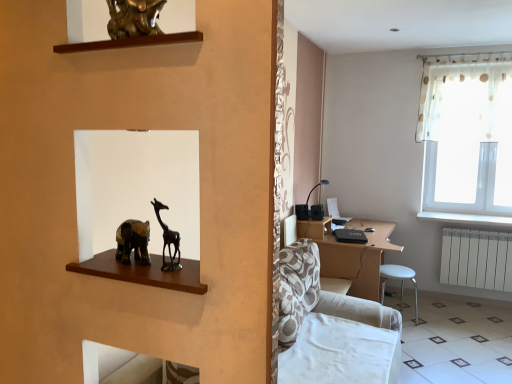
Where is `white painted wood at right`? white painted wood at right is located at coordinates pos(466,218).

Describe the element at coordinates (455, 342) in the screenshot. I see `white glossy tile at lower right` at that location.

You are a GUI agent. You are given a task and a screenshot of the screen. Output one action in this format:
    pyautogui.click(x=<x>, y=<y>)
    Task: Click on the white glossy tile at lower right
    This screenshot has width=512, height=384.
    Given the screenshot: What is the action you would take?
    pyautogui.click(x=455, y=342)

Describe the element at coordinates (315, 188) in the screenshot. Image resolution: width=512 pixels, height=384 pixels. I see `matte black table lamp at center-right` at that location.

Where is `white painted wood at right`? The width and height of the screenshot is (512, 384). white painted wood at right is located at coordinates (466, 218).

Considering the relative sizes of white painted wood at right and white plastic stool at lower right in the image provided, is white painted wood at right bigger than white plastic stool at lower right?

Actually, white painted wood at right might be smaller than white plastic stool at lower right.

Is white painted wood at right to the left of white plastic stool at lower right from the viewer's perspective?

In fact, white painted wood at right is to the right of white plastic stool at lower right.

Which point is more forward, (448, 221) or (407, 277)?

Point (407, 277)

Looking at their sizes, would you say white painted wood at right is wider or thinner than white plastic stool at lower right?

In the image, white painted wood at right appears to be wider than white plastic stool at lower right.

Locate an element on the screen. bar stool that appears in front of the white plastic radiator at lower right is located at coordinates (399, 279).

Is white plastic stool at lower right oriented towards white plastic radiator at lower right?

No, white plastic stool at lower right is not turned towards white plastic radiator at lower right.

Does point (386, 266) come closer to viewer compared to point (450, 283)?

Yes, point (386, 266) is in front of point (450, 283).

Is white plastic stool at lower right placed right next to white plastic radiator at lower right?

No, white plastic stool at lower right is not next to white plastic radiator at lower right.

Could white glossy tile at lower right be considered to be inside white painted wood at right?

Actually, white glossy tile at lower right is outside white painted wood at right.

Is white painted wood at right wider or thinner than white glossy tile at lower right?

white painted wood at right is thinner than white glossy tile at lower right.

Is white painted wood at right shorter than white glossy tile at lower right?

Correct, white painted wood at right is not as tall as white glossy tile at lower right.

From a real-world perspective, does white painted wood at right stand above white glossy tile at lower right?

Yes, from a real-world perspective, white painted wood at right is over white glossy tile at lower right

Considering the positions of objects white glossy tile at lower right and white plastic radiator at lower right in the image provided, who is more to the left, white glossy tile at lower right or white plastic radiator at lower right?

white glossy tile at lower right is more to the left.

From the image's perspective, who appears lower, white glossy tile at lower right or white plastic radiator at lower right?

white glossy tile at lower right appears lower in the image.

Considering the sizes of objects white glossy tile at lower right and white plastic radiator at lower right in the image provided, who is bigger, white glossy tile at lower right or white plastic radiator at lower right?

white glossy tile at lower right is bigger.

Is point (407, 292) farther from camera compared to point (502, 221)?

That is True.

Looking at the image, does white glossy tile at lower right seem bigger or smaller compared to white painted wood at right?

Considering their sizes, white glossy tile at lower right takes up more space than white painted wood at right.

Does white glossy tile at lower right contain white painted wood at right?

No, white glossy tile at lower right does not contain white painted wood at right.

Does white glossy tile at lower right have a lesser height compared to white painted wood at right?

No, white glossy tile at lower right is not shorter than white painted wood at right.

Looking at their sizes, would you say white plastic radiator at lower right is wider or thinner than white glossy tile at lower right?

In the image, white plastic radiator at lower right appears to be more narrow than white glossy tile at lower right.

Which is in front, point (507, 248) or point (470, 322)?

The point (470, 322) is closer.

Based on the photo, between white plastic radiator at lower right and white glossy tile at lower right, which one is positioned in front?

white glossy tile at lower right is in front.

Which of these two, white plastic radiator at lower right or white glossy tile at lower right, stands shorter?

white glossy tile at lower right.

Which is correct: white painted wood at right is inside brown wooden desk at center, or outside of it?

white painted wood at right cannot be found inside brown wooden desk at center.

Which is behind, point (499, 221) or point (322, 266)?

Positioned behind is point (499, 221).

From a real-world perspective, relative to brown wooden desk at center, is white painted wood at right vertically above or below?

white painted wood at right is above brown wooden desk at center.

Locate an element on the screen. This screenshot has height=384, width=512. bar stool lying on the left of white painted wood at right is located at coordinates (399, 279).

Where is `radiator above the white plastic stool at lower right (from the image's perspective)`? The width and height of the screenshot is (512, 384). radiator above the white plastic stool at lower right (from the image's perspective) is located at coordinates (477, 259).

Looking at the image, which one is located closer to white plastic stool at lower right, white painted wood at right or white plastic radiator at lower right?

The object closer to white plastic stool at lower right is white plastic radiator at lower right.

Based on their spatial positions, is white painted wood at right or white plastic stool at lower right closer to brown wooden desk at center?

white plastic stool at lower right is closer to brown wooden desk at center.

Estimate the real-world distances between objects in this image. Which object is further from matte black table lamp at center-right, white plastic radiator at lower right or white painted wood at right?

Among the two, white plastic radiator at lower right is located further to matte black table lamp at center-right.

From the picture: Looking at the image, which one is located further to white plastic stool at lower right, matte black table lamp at center-right or white painted wood at right?

Based on the image, matte black table lamp at center-right appears to be further to white plastic stool at lower right.

When comparing their distances from brown wooden desk at center, does matte black table lamp at center-right or white plastic radiator at lower right seem closer?

Based on the image, matte black table lamp at center-right appears to be nearer to brown wooden desk at center.

When comparing their distances from white painted wood at right, does white glossy tile at lower right or white plastic stool at lower right seem closer?

white plastic stool at lower right lies closer to white painted wood at right than the other object.

When comparing their distances from matte black table lamp at center-right, does brown wooden desk at center or white plastic radiator at lower right seem closer?

The object closer to matte black table lamp at center-right is brown wooden desk at center.

From the image, which object appears to be farther from white plastic radiator at lower right, brown wooden desk at center or white painted wood at right?

brown wooden desk at center is positioned further to the anchor white plastic radiator at lower right.

Locate an element on the screen. This screenshot has width=512, height=384. bar stool located between white glossy tile at lower right and matte black table lamp at center-right in the depth direction is located at coordinates (399, 279).

The width and height of the screenshot is (512, 384). Find the location of `bar stool between matte black table lamp at center-right and white painted wood at right from left to right`. bar stool between matte black table lamp at center-right and white painted wood at right from left to right is located at coordinates point(399,279).

Locate an element on the screen. The width and height of the screenshot is (512, 384). table positioned between white glossy tile at lower right and white plastic radiator at lower right from near to far is located at coordinates (352, 254).

Locate an element on the screen. Image resolution: width=512 pixels, height=384 pixels. table between matte black table lamp at center-right and white plastic radiator at lower right from left to right is located at coordinates (352, 254).